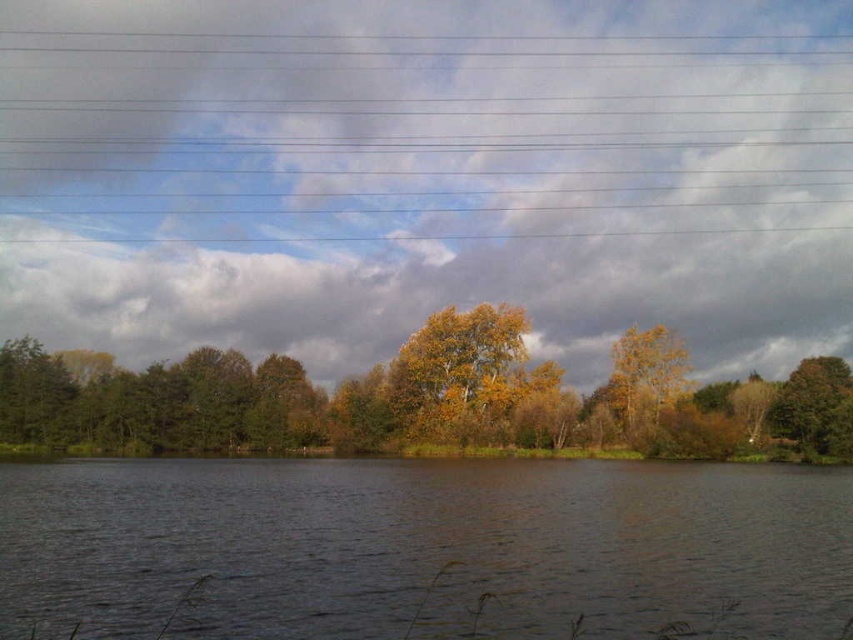
Question: Is cloudy sky at upper center to the left of golden-brown bark tree at center from the viewer's perspective?

Choices:
 (A) no
 (B) yes

Answer: (B)

Question: Does golden-brown bark tree at center appear on the left side of yellow leafy tree at right?

Choices:
 (A) yes
 (B) no

Answer: (A)

Question: Among these objects, which one is farthest from the camera?

Choices:
 (A) green leafy tree at right
 (B) yellow leafy tree at right
 (C) cloudy sky at upper center
 (D) golden leaves tree at center

Answer: (C)

Question: Estimate the real-world distances between objects in this image. Which object is closer to the yellow leafy tree at right?

Choices:
 (A) cloudy sky at upper center
 (B) dark water at center

Answer: (B)

Question: Is golden leaves tree at center smaller than golden-brown bark tree at center?

Choices:
 (A) no
 (B) yes

Answer: (A)

Question: Which is nearer to the green leafy tree at right?

Choices:
 (A) golden-brown bark tree at center
 (B) dark water at center

Answer: (A)